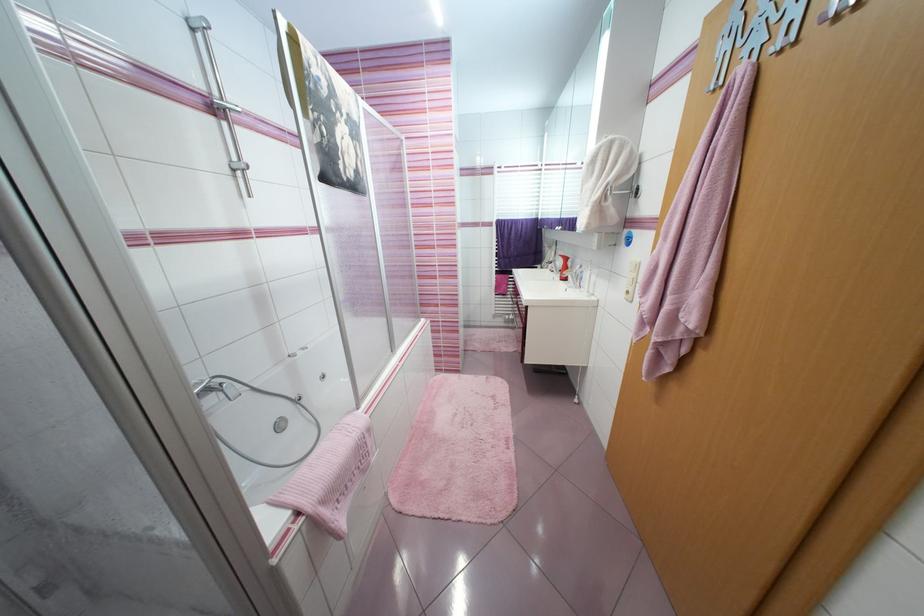
Where is `sink faucet handle`? sink faucet handle is located at coordinates (215, 387).